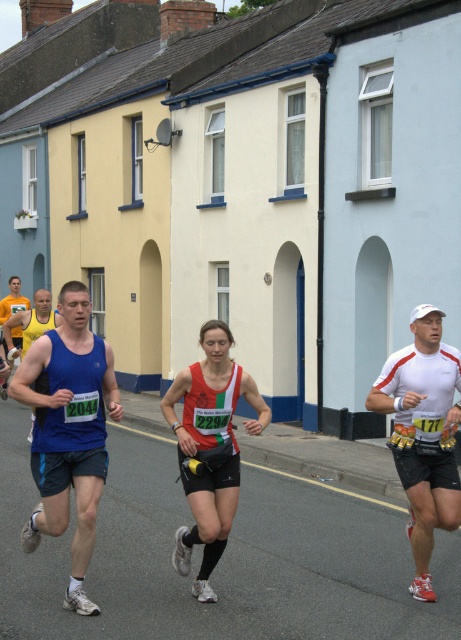
Consider the image. Between blue fabric tank top at center and white matte running shirt at center, which one appears on the left side from the viewer's perspective?

blue fabric tank top at center is more to the left.

This screenshot has height=640, width=461. What do you see at coordinates (69, 429) in the screenshot?
I see `blue fabric tank top at center` at bounding box center [69, 429].

At what (x,y) coordinates should I click in order to perform the action: click on blue fabric tank top at center. Please return your answer as a coordinate pair (x, y). This screenshot has height=640, width=461. Looking at the image, I should click on (69, 429).

How far apart are blue fabric tank top at center and red and white running outfit at center?

They are 80.83 centimeters apart.

Which is behind, point (74, 428) or point (200, 492)?

Point (200, 492)

Describe the element at coordinates (69, 429) in the screenshot. I see `blue fabric tank top at center` at that location.

The width and height of the screenshot is (461, 640). Identify the location of blue fabric tank top at center. (69, 429).

Who is higher up, white matte running shirt at center or blue fabric tank top at left?

blue fabric tank top at left

Which is below, white matte running shirt at center or blue fabric tank top at left?

Positioned lower is white matte running shirt at center.

Which is behind, point (395, 372) or point (35, 316)?

The point (35, 316) is more distant.

Locate an element on the screen. white matte running shirt at center is located at coordinates (424, 433).